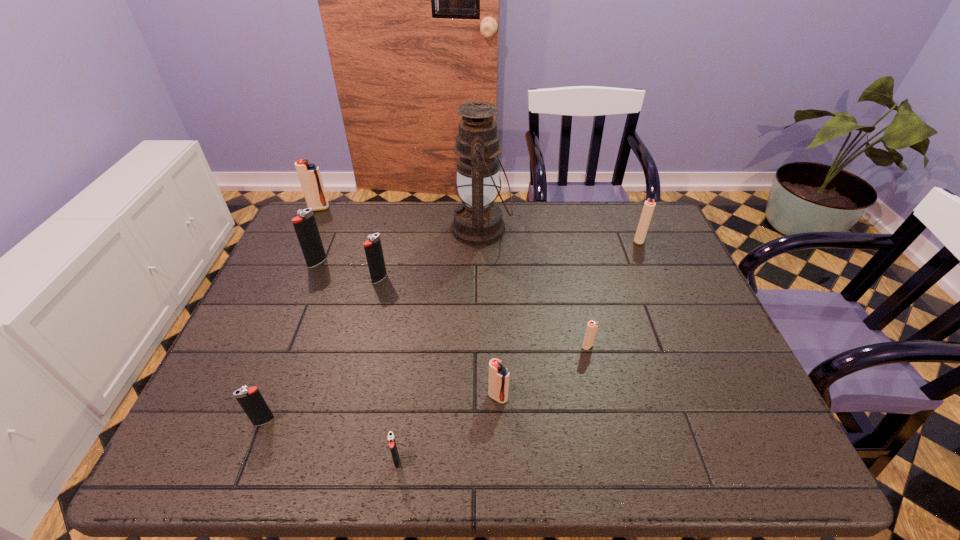
Where is `free space located 0.130m on the back of the third nearest red igniter`? The height and width of the screenshot is (540, 960). free space located 0.130m on the back of the third nearest red igniter is located at coordinates (627, 211).

In order to click on free spot located 0.220m on the left of the fourth object from left to right in this screenshot , I will do `click(294, 279)`.

The height and width of the screenshot is (540, 960). What are the coordinates of `vacant space situated 0.380m on the back of the third biggest black igniter` in the screenshot? It's located at (316, 289).

You are a GUI agent. You are given a task and a screenshot of the screen. Output one action in this format:
    pyautogui.click(x=<x>, y=<y>)
    Task: Click on the free point located 0.220m on the right of the seventh farthest object
    This screenshot has width=960, height=540.
    Given the screenshot: What is the action you would take?
    pyautogui.click(x=609, y=397)

Where is `vacant space situated 0.300m on the left of the fifth farthest igniter`? The width and height of the screenshot is (960, 540). vacant space situated 0.300m on the left of the fifth farthest igniter is located at coordinates (456, 346).

Image resolution: width=960 pixels, height=540 pixels. I want to click on vacant space located 0.360m on the right of the fifth igniter from left to right, so click(587, 461).

You are a GUI agent. You are given a task and a screenshot of the screen. Output one action in this format:
    pyautogui.click(x=<x>, y=<y>)
    Task: Click on the oil lamp situated at the far edge
    The width and height of the screenshot is (960, 540).
    Given the screenshot: What is the action you would take?
    (x=477, y=221)

This screenshot has height=540, width=960. What are the coordinates of `object at the right edge` in the screenshot? It's located at (649, 205).

What are the coordinates of `object present at the far left corner` in the screenshot? It's located at (309, 175).

This screenshot has width=960, height=540. Find the location of `object located in the near left corner section of the desktop`. object located in the near left corner section of the desktop is located at coordinates coord(252,402).